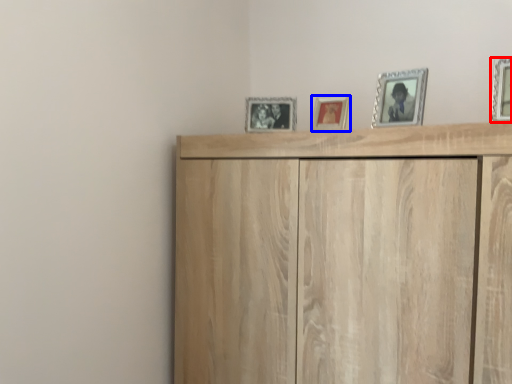
Question: Which point is closer to the camera, picture frame (highlighted by a red box) or picture frame (highlighted by a blue box)?

Choices:
 (A) picture frame
 (B) picture frame

Answer: (A)